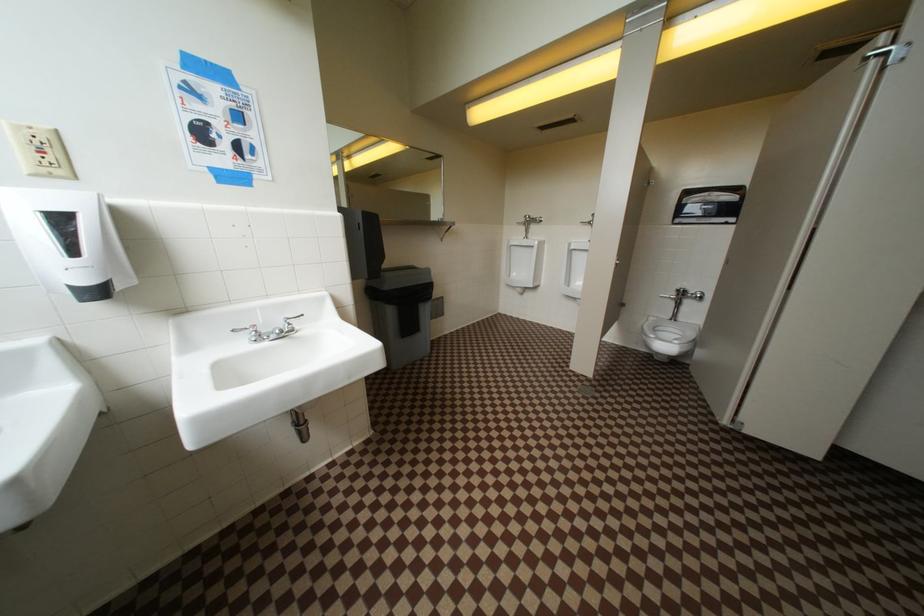
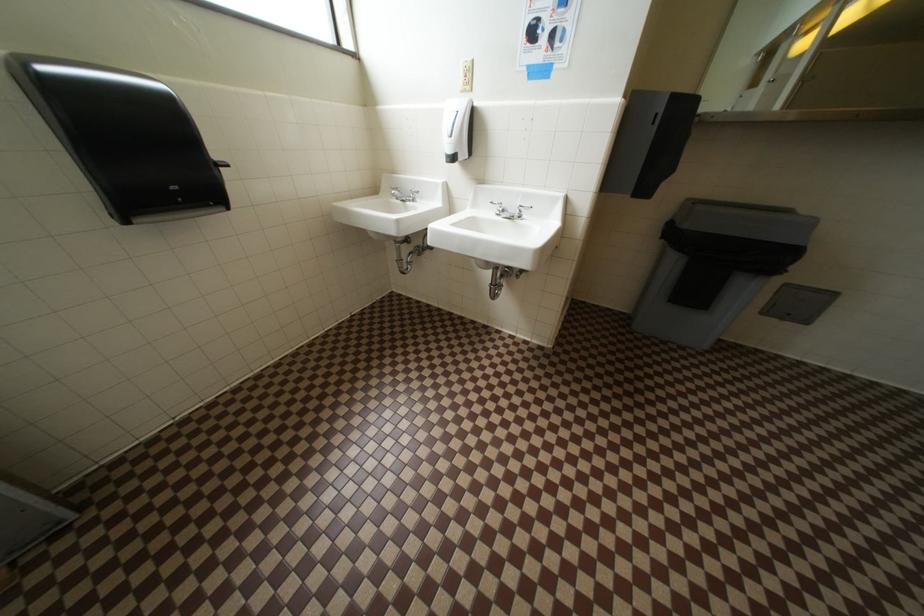
First-person continuous shooting, in which direction is the camera rotating?

The rotation direction of the camera is left-down.